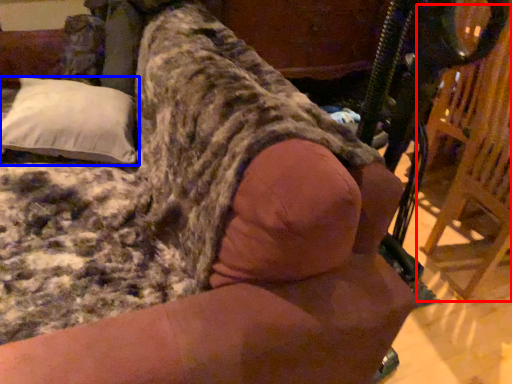
Question: Which point is closer to the camera, swivel chair (highlighted by a red box) or pillow (highlighted by a blue box)?

Choices:
 (A) swivel chair
 (B) pillow

Answer: (A)